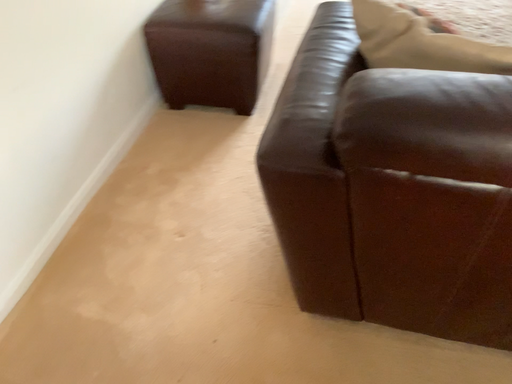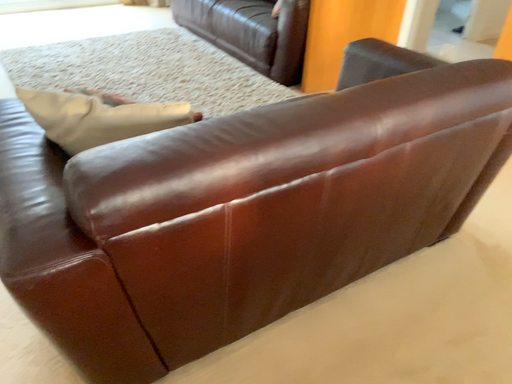
Question: How did the camera likely rotate when shooting the video?

Choices:
 (A) rotated downward
 (B) rotated upward

Answer: (B)